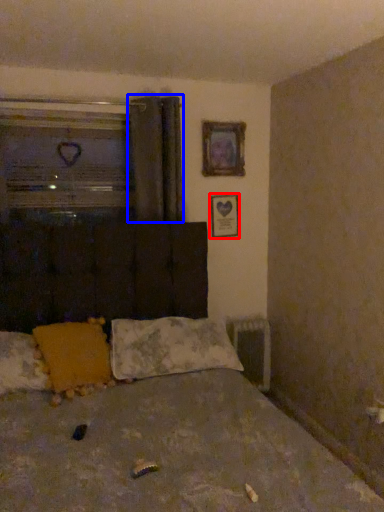
Question: Among these objects, which one is nearest to the camera, picture frame (highlighted by a red box) or curtain (highlighted by a blue box)?

Choices:
 (A) picture frame
 (B) curtain

Answer: (B)